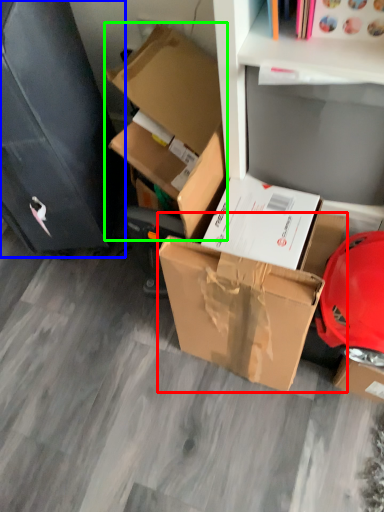
Question: Considering the real-world distances, which object is farthest from box (highlighted by a red box)? file cabinet (highlighted by a blue box) or box (highlighted by a green box)?

Choices:
 (A) file cabinet
 (B) box

Answer: (A)